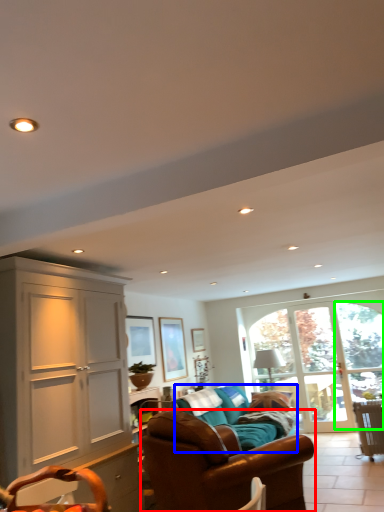
Question: Estimate the real-world distances between objects in this image. Which object is closer to studio couch (highlighted by a red box), studio couch (highlighted by a blue box) or window (highlighted by a green box)?

Choices:
 (A) studio couch
 (B) window

Answer: (A)